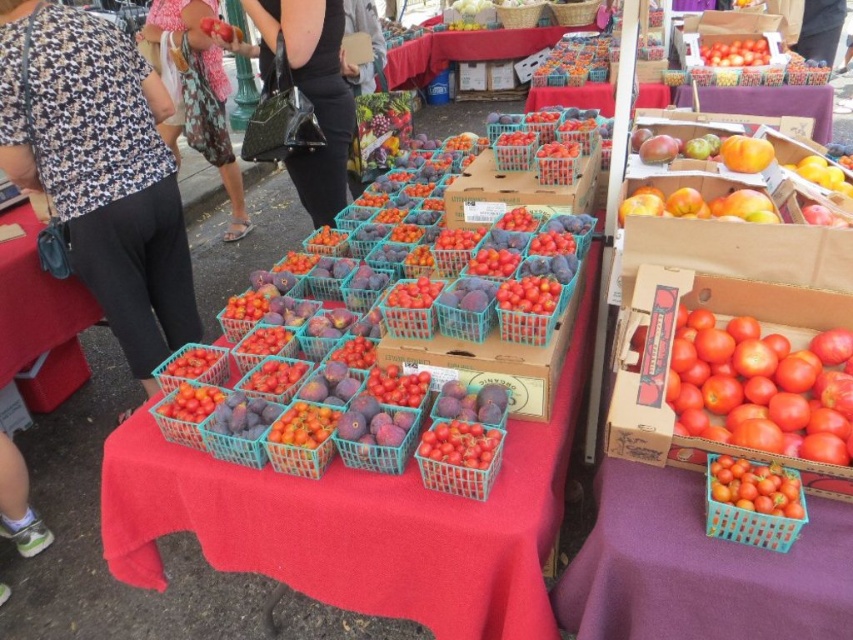
You are a customer at the market and want to buy a wallet. You see the leather wallet at lower left and the purple wood table at upper right. Which object is closer to you?

The leather wallet at lower left is closer to you because it is in front of the purple wood table at upper right.